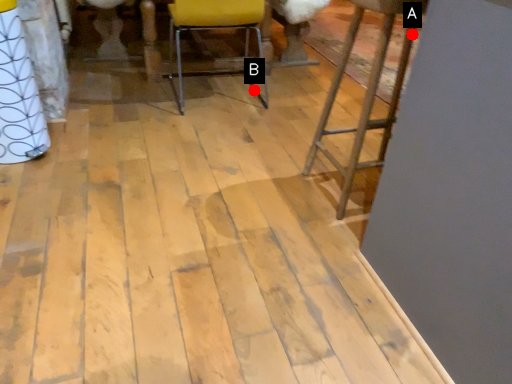
Question: Two points are circled on the image, labeled by A and B beside each circle. Which of the following is the closest to the observer?

Choices:
 (A) A is closer
 (B) B is closer

Answer: (A)